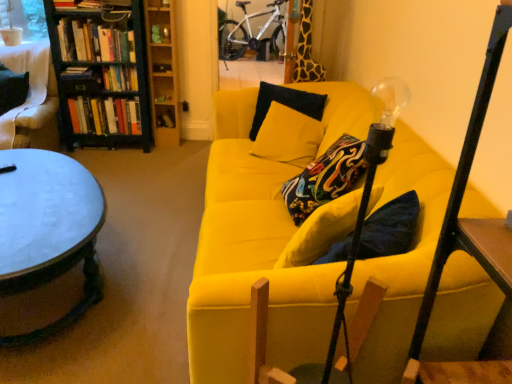
Question: From the image's perspective, is hardcover book at upper center, which appears as the 2th book when viewed from the top, on hardcover books at upper left, which is counted as the fifth book, starting from the bottom?

Choices:
 (A) yes
 (B) no

Answer: (B)

Question: Does hardcover book at upper center, which appears as the 2th book when viewed from the top, have a smaller size compared to hardcover books at upper left, which is counted as the fifth book, starting from the bottom?

Choices:
 (A) yes
 (B) no

Answer: (A)

Question: Is hardcover book at upper center, placed as the fourth book when sorted from bottom to top, shorter than hardcover books at upper left, which is counted as the fifth book, starting from the bottom?

Choices:
 (A) no
 (B) yes

Answer: (B)

Question: Is hardcover book at upper center, placed as the fourth book when sorted from bottom to top, positioned with its back to hardcover books at upper left, which is counted as the fifth book, starting from the bottom?

Choices:
 (A) yes
 (B) no

Answer: (B)

Question: Does hardcover book at upper center, which appears as the 2th book when viewed from the top, have a greater width compared to hardcover books at upper left, which is counted as the fifth book, starting from the bottom?

Choices:
 (A) no
 (B) yes

Answer: (A)

Question: Is point (167, 67) closer or farther from the camera than point (35, 336)?

Choices:
 (A) closer
 (B) farther

Answer: (B)

Question: Which is correct: hardcover book at upper center, which appears as the 2th book when viewed from the top, is inside metallic round table at left, or outside of it?

Choices:
 (A) outside
 (B) inside

Answer: (A)

Question: Looking at the image, does hardcover book at upper center, placed as the fourth book when sorted from bottom to top, seem bigger or smaller compared to metallic round table at left?

Choices:
 (A) big
 (B) small

Answer: (B)

Question: Considering the positions of hardcover book at upper center, placed as the fourth book when sorted from bottom to top, and metallic round table at left in the image, is hardcover book at upper center, placed as the fourth book when sorted from bottom to top, taller or shorter than metallic round table at left?

Choices:
 (A) tall
 (B) short

Answer: (B)

Question: Is hardcover book at upper center, placed as the fourth book when sorted from bottom to top, in front of or behind hardcover books at upper left, which is counted as the first book, starting from the top, in the image?

Choices:
 (A) front
 (B) behind

Answer: (B)

Question: In terms of size, does hardcover book at upper center, placed as the fourth book when sorted from bottom to top, appear bigger or smaller than hardcover books at upper left, which is counted as the first book, starting from the top?

Choices:
 (A) small
 (B) big

Answer: (A)

Question: From their relative heights in the image, would you say hardcover book at upper center, placed as the fourth book when sorted from bottom to top, is taller or shorter than hardcover books at upper left, which is counted as the first book, starting from the top?

Choices:
 (A) short
 (B) tall

Answer: (A)

Question: From a real-world perspective, is hardcover book at upper center, placed as the fourth book when sorted from bottom to top, physically located above or below hardcover books at upper left, which is counted as the first book, starting from the top?

Choices:
 (A) above
 (B) below

Answer: (B)

Question: Considering the positions of wooden bookcase at upper center, which is the first bookcase in right-to-left order, and yellow fabric couch at center in the image, is wooden bookcase at upper center, which is the first bookcase in right-to-left order, taller or shorter than yellow fabric couch at center?

Choices:
 (A) short
 (B) tall

Answer: (B)

Question: In the image, is wooden bookcase at upper center, the 2th bookcase when ordered from left to right, positioned in front of or behind yellow fabric couch at center?

Choices:
 (A) behind
 (B) front

Answer: (A)